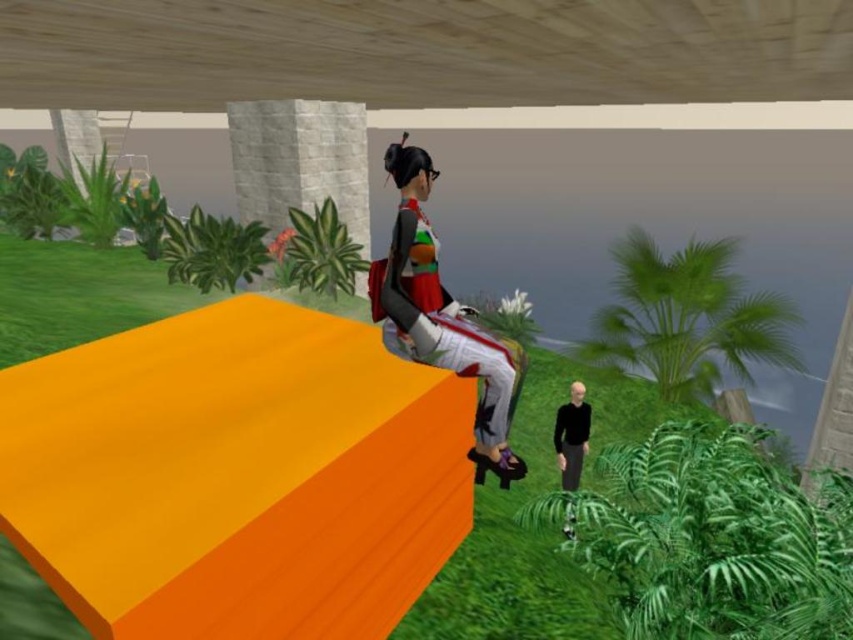
Question: Is matte fabric outfit at center further to the viewer compared to black matte shirt at lower right?

Choices:
 (A) no
 (B) yes

Answer: (A)

Question: Which point appears farthest from the camera in this image?

Choices:
 (A) (579, 416)
 (B) (349, 236)
 (C) (508, 426)

Answer: (B)

Question: Is matte fabric outfit at center smaller than gray stone pillar at upper center?

Choices:
 (A) yes
 (B) no

Answer: (A)

Question: Among these points, which one is nearest to the camera?

Choices:
 (A) (247, 115)
 (B) (570, 472)

Answer: (B)

Question: Does gray stone pillar at upper center have a greater width compared to black matte shirt at lower right?

Choices:
 (A) yes
 (B) no

Answer: (A)

Question: Estimate the real-world distances between objects in this image. Which object is farther from the matte fabric outfit at center?

Choices:
 (A) black matte shirt at lower right
 (B) gray stone pillar at upper center

Answer: (B)